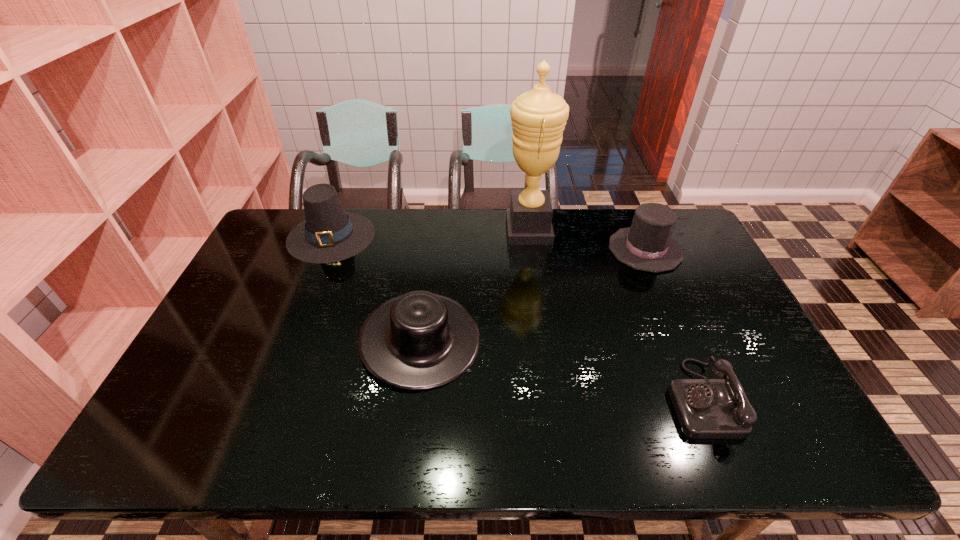
Locate an element on the screen. The image size is (960, 540). dress hat situated at the right edge is located at coordinates (647, 245).

Locate an element on the screen. Image resolution: width=960 pixels, height=540 pixels. telephone present at the right edge is located at coordinates (706, 408).

Locate an element on the screen. Image resolution: width=960 pixels, height=540 pixels. object that is at the far left corner is located at coordinates (328, 234).

Identify the location of object that is at the far right corner. (647, 245).

You are a GUI agent. You are given a task and a screenshot of the screen. Output one action in this format:
    pyautogui.click(x=<x>, y=<y>)
    Task: Click on the object positioned at the near right corner
    The image size is (960, 540).
    Given the screenshot: What is the action you would take?
    pyautogui.click(x=706, y=408)

Where is `vacant space at the far edge of the desktop`? vacant space at the far edge of the desktop is located at coordinates (592, 238).

Locate an element on the screen. The image size is (960, 540). vacant region at the near edge of the desktop is located at coordinates (737, 443).

Identify the location of vacant space at the left edge of the desktop. (292, 276).

Identify the location of free location at the right edge. This screenshot has width=960, height=540. (730, 314).

You are a GUI agent. You are given a task and a screenshot of the screen. Output one action in this format:
    pyautogui.click(x=<x>, y=<y>)
    Task: Click on the vacant space at the far right corner of the desktop
    The image size is (960, 540).
    Given the screenshot: What is the action you would take?
    pyautogui.click(x=682, y=216)